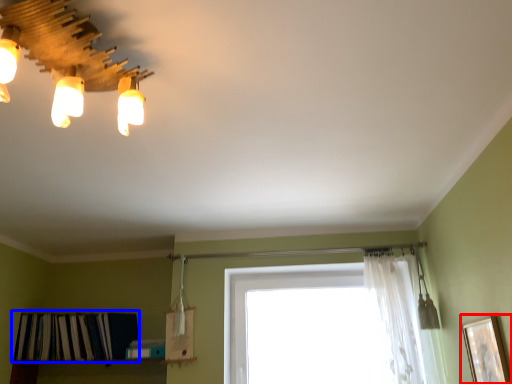
Question: Which object is further to the camera taking this photo, picture frame (highlighted by a red box) or shelf (highlighted by a blue box)?

Choices:
 (A) picture frame
 (B) shelf

Answer: (B)